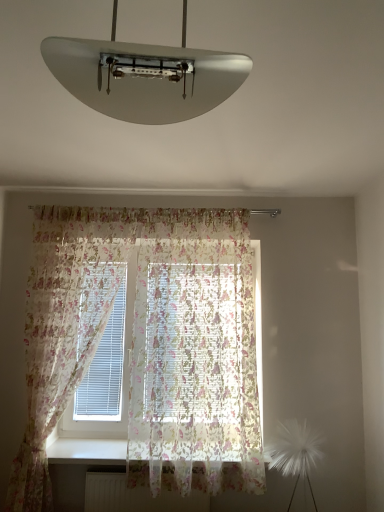
Question: From the image's perspective, is white glossy lampshade at upper center located beneath white smooth window sill at lower center?

Choices:
 (A) yes
 (B) no

Answer: (B)

Question: Does white glossy lampshade at upper center appear on the right side of white smooth window sill at lower center?

Choices:
 (A) no
 (B) yes

Answer: (B)

Question: From a real-world perspective, is white glossy lampshade at upper center located beneath white smooth window sill at lower center?

Choices:
 (A) yes
 (B) no

Answer: (B)

Question: Is white glossy lampshade at upper center to the left of white smooth window sill at lower center from the viewer's perspective?

Choices:
 (A) yes
 (B) no

Answer: (B)

Question: Can white smooth window sill at lower center be found inside white glossy lampshade at upper center?

Choices:
 (A) no
 (B) yes

Answer: (A)

Question: From the image's perspective, is white glossy lampshade at upper center located above or below white smooth window sill at lower center?

Choices:
 (A) above
 (B) below

Answer: (A)

Question: From a real-world perspective, is white glossy lampshade at upper center above or below white smooth window sill at lower center?

Choices:
 (A) below
 (B) above

Answer: (B)

Question: Is white glossy lampshade at upper center to the left or to the right of white smooth window sill at lower center in the image?

Choices:
 (A) left
 (B) right

Answer: (B)

Question: In terms of width, does white glossy lampshade at upper center look wider or thinner when compared to white smooth window sill at lower center?

Choices:
 (A) wide
 (B) thin

Answer: (B)

Question: Looking at their shapes, would you say white matte radiator at lower center is wider or thinner than translucent floral curtain at center, which is the second curtain from left to right?

Choices:
 (A) wide
 (B) thin

Answer: (B)

Question: In the image, is white matte radiator at lower center on the left side or the right side of translucent floral curtain at center, which is the second curtain from left to right?

Choices:
 (A) right
 (B) left

Answer: (B)

Question: Considering the positions of point (183, 505) and point (223, 484), is point (183, 505) closer or farther from the camera than point (223, 484)?

Choices:
 (A) farther
 (B) closer

Answer: (B)

Question: Looking at the image, does white matte radiator at lower center seem bigger or smaller compared to translucent floral curtain at center, which is the second curtain from left to right?

Choices:
 (A) small
 (B) big

Answer: (A)

Question: Does point (87, 66) appear closer or farther from the camera than point (89, 503)?

Choices:
 (A) closer
 (B) farther

Answer: (A)

Question: From the image's perspective, is white glossy lampshade at upper center above or below white matte radiator at lower center?

Choices:
 (A) above
 (B) below

Answer: (A)